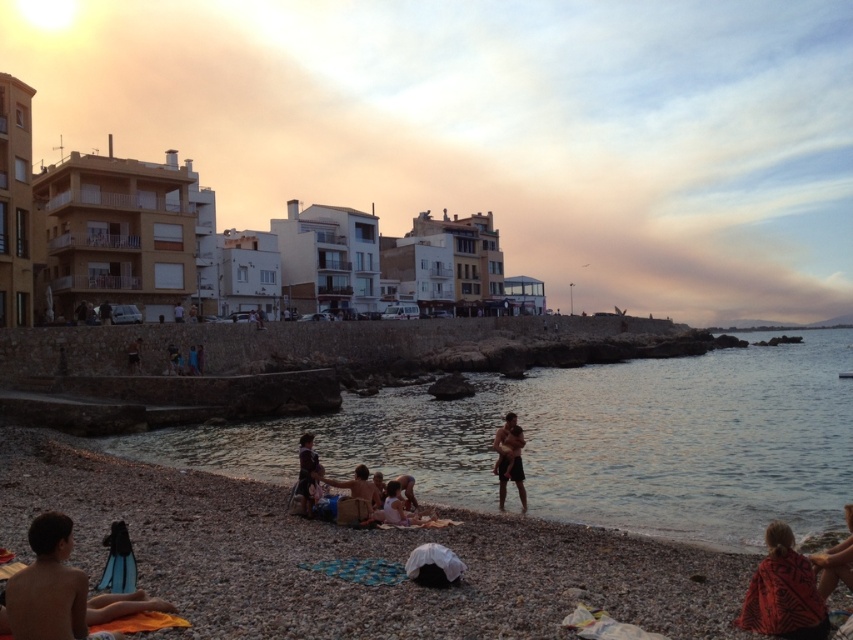
Question: Does orange towel at lower right have a lesser width compared to white cotton shirt at center?

Choices:
 (A) yes
 (B) no

Answer: (B)

Question: Does clear water at lower center lie behind dark brown leather jacket at center?

Choices:
 (A) yes
 (B) no

Answer: (B)

Question: Is smooth pebble beach at lower left positioned at the back of orange towel at lower right?

Choices:
 (A) no
 (B) yes

Answer: (A)

Question: Which of the following is the farthest from the observer?

Choices:
 (A) (757, 566)
 (B) (47, 616)
 (C) (392, 504)

Answer: (C)

Question: Which of the following is the farthest from the observer?

Choices:
 (A) brown textured shorts at center
 (B) smooth pebble beach at lower left

Answer: (A)

Question: Which object is closer to the camera taking this photo?

Choices:
 (A) skinny boy at lower left
 (B) dark brown leather jacket at center
 (C) brown textured shorts at center

Answer: (A)